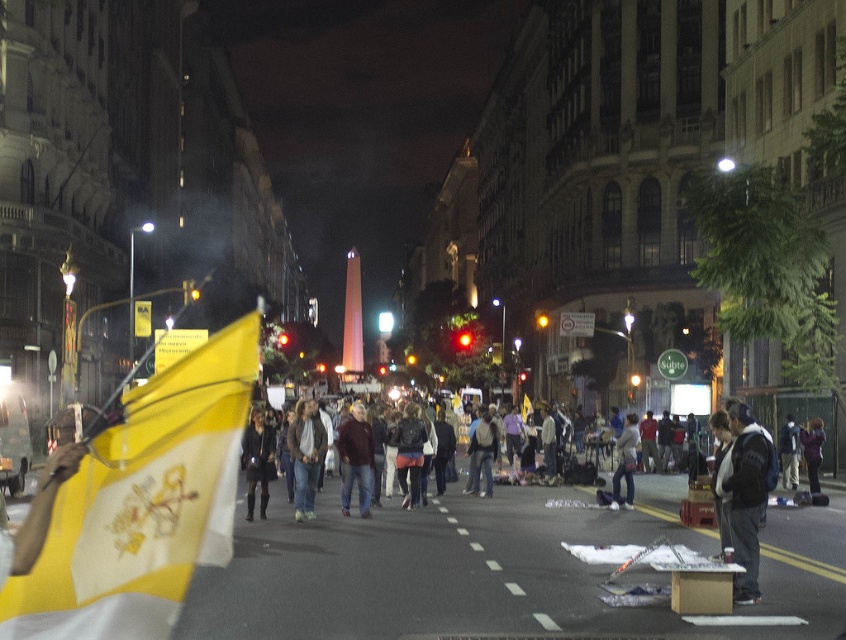
Is point (177, 586) closer to viewer compared to point (819, 444)?

That is True.

Does point (212, 378) come behind point (820, 428)?

Yes, it is behind point (820, 428).

The height and width of the screenshot is (640, 846). Identify the location of yellow fabric flag at center. (143, 504).

Between dark fabric coat at center and dark blue jacket at center, which one appears on the right side from the viewer's perspective?

dark blue jacket at center

Who is more distant from viewer, (255, 452) or (790, 456)?

Positioned behind is point (790, 456).

I want to click on dark fabric coat at center, so click(x=257, y=460).

In the scene shown: Between dark fabric coat at center and light brown leather jacket at center, which one has less height?

light brown leather jacket at center

Is dark fabric coat at center wider than light brown leather jacket at center?

Correct, the width of dark fabric coat at center exceeds that of light brown leather jacket at center.

Locate an element on the screen. This screenshot has height=640, width=846. dark fabric coat at center is located at coordinates (257, 460).